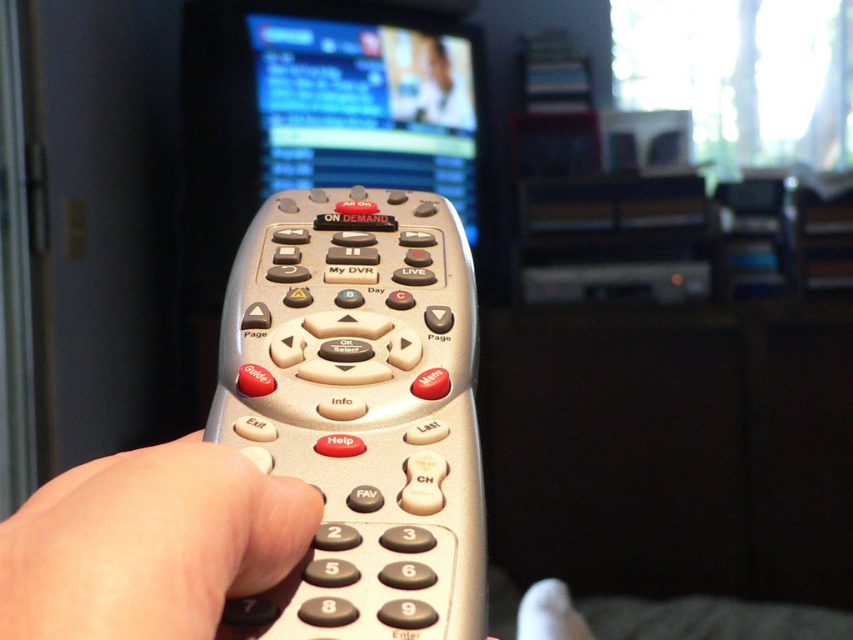
Question: Can you confirm if silver metallic remote at center is thinner than skinny beige hand at center?

Choices:
 (A) no
 (B) yes

Answer: (A)

Question: Can you confirm if silver metallic remote at center is positioned to the right of skinny beige hand at center?

Choices:
 (A) yes
 (B) no

Answer: (A)

Question: Can you confirm if silver metallic remote at center is thinner than skinny beige hand at center?

Choices:
 (A) no
 (B) yes

Answer: (A)

Question: Which object is farther from the camera taking this photo?

Choices:
 (A) skinny beige hand at center
 (B) silver metallic remote at center

Answer: (B)

Question: Which of the following is the closest to the observer?

Choices:
 (A) (399, 433)
 (B) (6, 545)

Answer: (B)